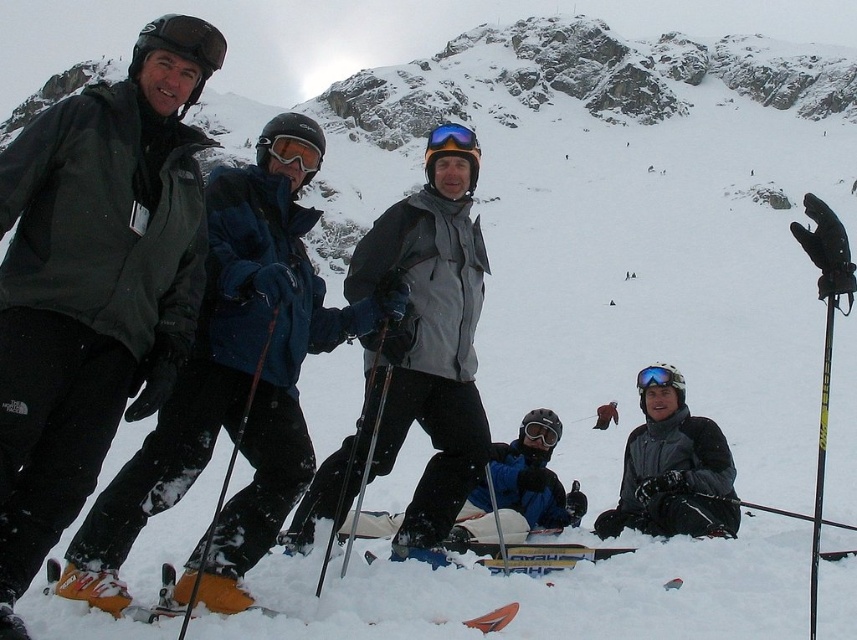
Question: Estimate the real-world distances between objects in this image. Which object is farther from the yellow matte ski at center?

Choices:
 (A) orange plastic ski at lower left
 (B) blue reflective lens goggles at center
 (C) matte black ski at left

Answer: (B)

Question: Which object is farther from the camera taking this photo?

Choices:
 (A) yellow matte ski at center
 (B) orange plastic ski at lower left
 (C) matte black ski at left

Answer: (A)

Question: Which point is farther to the camera?

Choices:
 (A) (589, 547)
 (B) (165, 586)
 (C) (429, 148)

Answer: (C)

Question: Does orange plastic ski at lower left lie in front of blue reflective lens goggles at center?

Choices:
 (A) no
 (B) yes

Answer: (B)

Question: Does matte black ski at left have a larger size compared to blue reflective lens goggles at center?

Choices:
 (A) yes
 (B) no

Answer: (B)

Question: Is yellow matte ski at center thinner than blue reflective lens goggles at center?

Choices:
 (A) yes
 (B) no

Answer: (B)